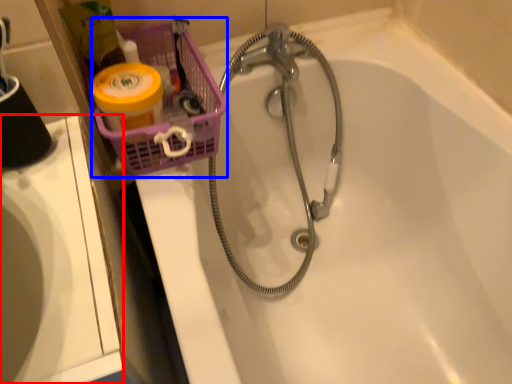
Question: Which object appears farthest to the camera in this image, sink (highlighted by a red box) or basket (highlighted by a blue box)?

Choices:
 (A) sink
 (B) basket

Answer: (B)